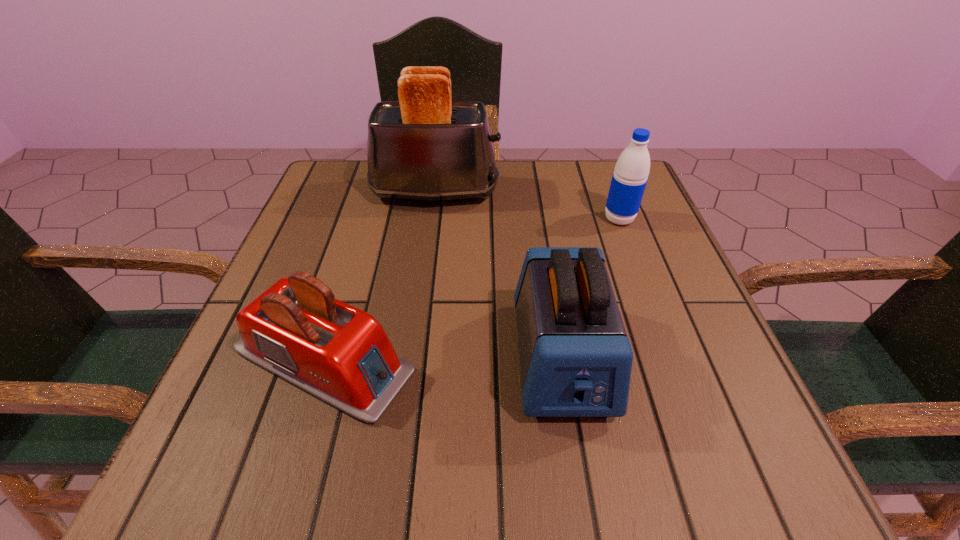
This screenshot has height=540, width=960. I want to click on water bottle that is at the far edge, so click(x=630, y=176).

Locate an element on the screen. The width and height of the screenshot is (960, 540). object positioned at the right edge is located at coordinates (630, 176).

Find the location of `object at the far left corner`. object at the far left corner is located at coordinates (426, 147).

Identify the location of object that is at the far right corner. (630, 176).

In the image, there is a desktop. Where is `vacant space at the far edge`? The width and height of the screenshot is (960, 540). vacant space at the far edge is located at coordinates (544, 161).

Where is `free spot at the near edge of the desktop`? The height and width of the screenshot is (540, 960). free spot at the near edge of the desktop is located at coordinates (642, 457).

What are the coordinates of `vacant region at the left edge` in the screenshot? It's located at (340, 284).

You are a GUI agent. You are given a task and a screenshot of the screen. Output one action in this format:
    pyautogui.click(x=<x>, y=<y>)
    Task: Click on the vacant space at the right edge
    
    Given the screenshot: What is the action you would take?
    pyautogui.click(x=688, y=295)

At what (x,y) coordinates should I click in order to perform the action: click on free space at the far left corner. Please return your answer as a coordinate pair (x, y). The height and width of the screenshot is (540, 960). Looking at the image, I should click on (328, 174).

The height and width of the screenshot is (540, 960). I want to click on vacant space at the near right corner, so click(718, 438).